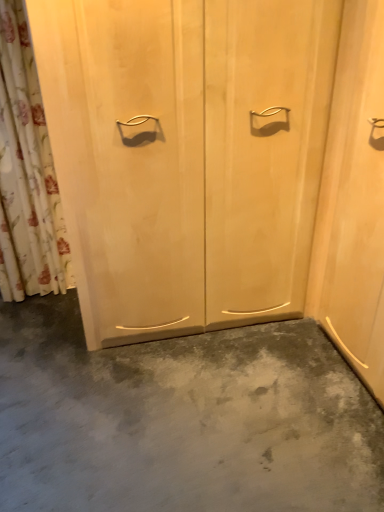
I want to click on floral fabric shower curtain at left, so click(x=27, y=173).

You are a GUI agent. You are given a task and a screenshot of the screen. Output one action in this format:
    pyautogui.click(x=<x>, y=<y>)
    Task: Click on the light wood/texture door at center
    This screenshot has height=512, width=384.
    Given the screenshot: What is the action you would take?
    pyautogui.click(x=187, y=155)

Where is `gray matte concrete at center`? The width and height of the screenshot is (384, 512). gray matte concrete at center is located at coordinates (181, 419).

Which object is further away from the camera taking this photo, gray matte concrete at center or light wood/texture door at center?

light wood/texture door at center.

From the image's perspective, relative to light wood/texture door at center, is gray matte concrete at center above or below?

From the image's perspective, gray matte concrete at center appears below light wood/texture door at center.

Who is taller, gray matte concrete at center or light wood/texture door at center?

light wood/texture door at center is taller.

Can you confirm if gray matte concrete at center is bigger than light wood/texture door at center?

No.

From the image's perspective, is light wood/texture door at center over gray matte concrete at center?

Correct, light wood/texture door at center appears higher than gray matte concrete at center in the image.

Considering the relative sizes of light wood/texture door at center and gray matte concrete at center in the image provided, is light wood/texture door at center bigger than gray matte concrete at center?

Yes, light wood/texture door at center is bigger than gray matte concrete at center.

Consider the image. Does light wood/texture door at center have a lesser width compared to gray matte concrete at center?

Yes.

I want to click on shower curtain located above the gray matte concrete at center (from the image's perspective), so click(27, 173).

In the scene shown: In terms of size, does floral fabric shower curtain at left appear bigger or smaller than gray matte concrete at center?

Considering their sizes, floral fabric shower curtain at left takes up less space than gray matte concrete at center.

Is floral fabric shower curtain at left positioned beyond the bounds of gray matte concrete at center?

floral fabric shower curtain at left is positioned outside gray matte concrete at center.

Is point (33, 214) farther from camera compared to point (189, 476)?

Yes, it is behind point (189, 476).

Does floral fabric shower curtain at left turn towards light wood/texture door at center?

No, floral fabric shower curtain at left is not oriented towards light wood/texture door at center.

What's the angular difference between floral fabric shower curtain at left and light wood/texture door at center's facing directions?

There is a 0.000195-degree angle between the facing directions of floral fabric shower curtain at left and light wood/texture door at center.

What are the coordinates of `door on the right of floral fabric shower curtain at left` in the screenshot? It's located at (187, 155).

Is point (58, 253) farther from viewer compared to point (238, 214)?

Yes, point (58, 253) is behind point (238, 214).

In the scene shown: Is gray matte concrete at center with floral fabric shower curtain at left?

There is a gap between gray matte concrete at center and floral fabric shower curtain at left.

From a real-world perspective, which is physically above, gray matte concrete at center or floral fabric shower curtain at left?

floral fabric shower curtain at left, from a real-world perspective.

Relative to floral fabric shower curtain at left, is gray matte concrete at center in front or behind?

Clearly, gray matte concrete at center is in front of floral fabric shower curtain at left.

Considering the sizes of objects gray matte concrete at center and floral fabric shower curtain at left in the image provided, who is shorter, gray matte concrete at center or floral fabric shower curtain at left?

With less height is gray matte concrete at center.

From a real-world perspective, is light wood/texture door at center above or below floral fabric shower curtain at left?

From a real-world perspective, light wood/texture door at center is physically below floral fabric shower curtain at left.

Based on the photo, can you confirm if light wood/texture door at center is wider than floral fabric shower curtain at left?

Yes.

What's the angular difference between light wood/texture door at center and floral fabric shower curtain at left's facing directions?

0.000195 degrees separate the facing orientations of light wood/texture door at center and floral fabric shower curtain at left.

Considering the points (207, 262) and (7, 256), which point is behind, point (207, 262) or point (7, 256)?

The point (7, 256) is behind.

Identify the location of concrete below the light wood/texture door at center (from a real-world perspective). (181, 419).

Find the location of `concrete below the light wood/texture door at center (from the image's perspective)`. concrete below the light wood/texture door at center (from the image's perspective) is located at coordinates (181, 419).

Looking at the image, which one is located closer to gray matte concrete at center, light wood/texture door at center or floral fabric shower curtain at left?

light wood/texture door at center is closer to gray matte concrete at center.

Which object lies nearer to the anchor point floral fabric shower curtain at left, light wood/texture door at center or gray matte concrete at center?

light wood/texture door at center is positioned closer to the anchor floral fabric shower curtain at left.

Based on their spatial positions, is floral fabric shower curtain at left or light wood/texture door at center further from gray matte concrete at center?

Among the two, floral fabric shower curtain at left is located further to gray matte concrete at center.

Based on their spatial positions, is floral fabric shower curtain at left or gray matte concrete at center further from light wood/texture door at center?

Based on the image, floral fabric shower curtain at left appears to be further to light wood/texture door at center.

Which object lies further to the anchor point light wood/texture door at center, gray matte concrete at center or floral fabric shower curtain at left?

floral fabric shower curtain at left is positioned further to the anchor light wood/texture door at center.

Which object lies further to the anchor point floral fabric shower curtain at left, gray matte concrete at center or light wood/texture door at center?

Based on the image, gray matte concrete at center appears to be further to floral fabric shower curtain at left.

Where is `door between floral fabric shower curtain at left and gray matte concrete at center from top to bottom`? door between floral fabric shower curtain at left and gray matte concrete at center from top to bottom is located at coordinates (187, 155).